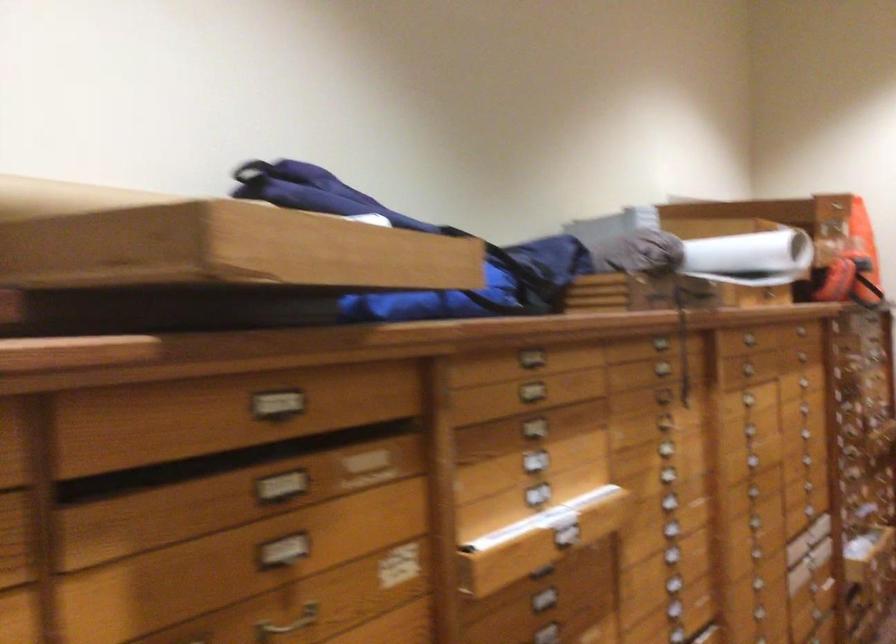
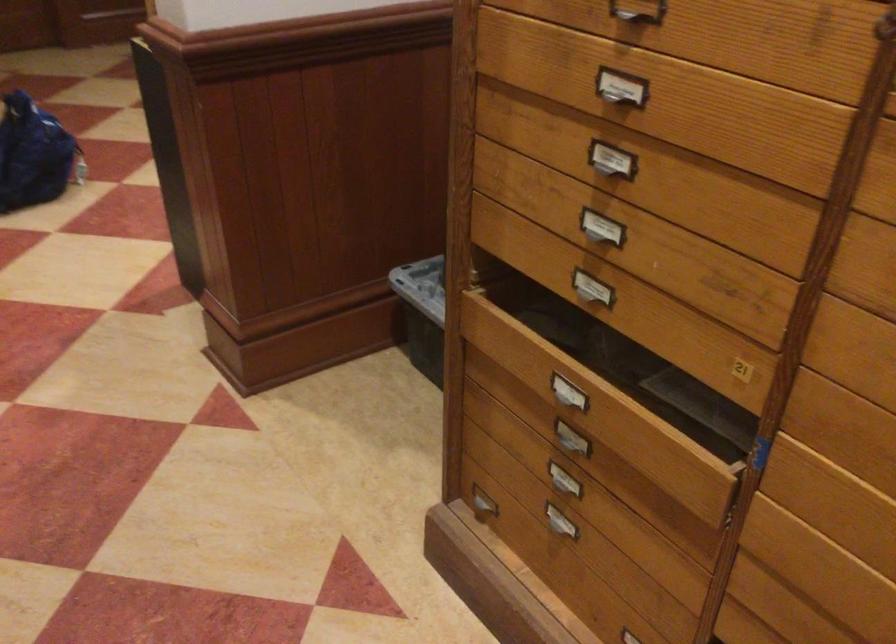
How did the camera likely rotate?

The camera's rotation is toward left-down.